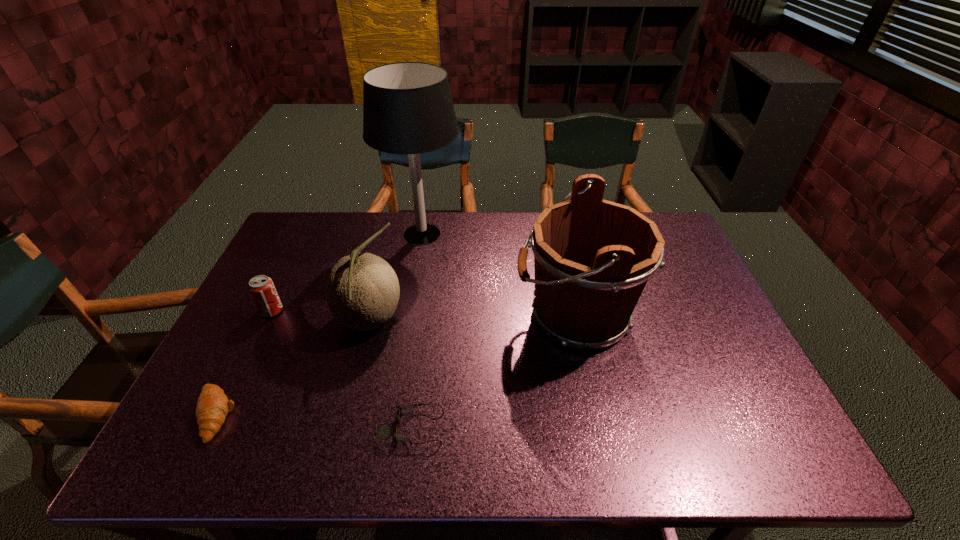
This screenshot has height=540, width=960. I want to click on vacant point located between the soda can and the shortest object, so 342,369.

Locate an element on the screen. This screenshot has width=960, height=540. vacant space in between the soda can and the fifth tallest object is located at coordinates (243, 363).

Where is `free area in between the fourth tallest object and the second tallest object`? Image resolution: width=960 pixels, height=540 pixels. free area in between the fourth tallest object and the second tallest object is located at coordinates (423, 313).

This screenshot has width=960, height=540. Identify the location of empty space between the fourth shortest object and the soda can. (321, 316).

I want to click on empty space between the shortest object and the table lamp, so click(x=418, y=330).

The width and height of the screenshot is (960, 540). Identify the location of empty space between the shortest object and the third tallest object. (391, 374).

Locate an element on the screen. unoccupied area between the spectacles and the second shortest object is located at coordinates (313, 421).

Locate which object is the closest to the cantaloup. Please provide its 2D coordinates. Your answer should be formatted as a tuple, i.e. [(x, y)], where the tuple contains the x and y coordinates of a point satisfying the conditions above.

[(262, 289)]

Identify which object is located as the fourth nearest to the farthest object. Please provide its 2D coordinates. Your answer should be formatted as a tuple, i.e. [(x, y)], where the tuple contains the x and y coordinates of a point satisfying the conditions above.

[(213, 405)]

At what (x,y) coordinates should I click in order to perform the action: click on vacant space that satisfies the following two spatial constraints: 1. with the handle on the side of the fifth shortest object; 2. on the front side of the third tallest object. Please return your answer as a coordinate pair (x, y). The height and width of the screenshot is (540, 960). Looking at the image, I should click on (576, 321).